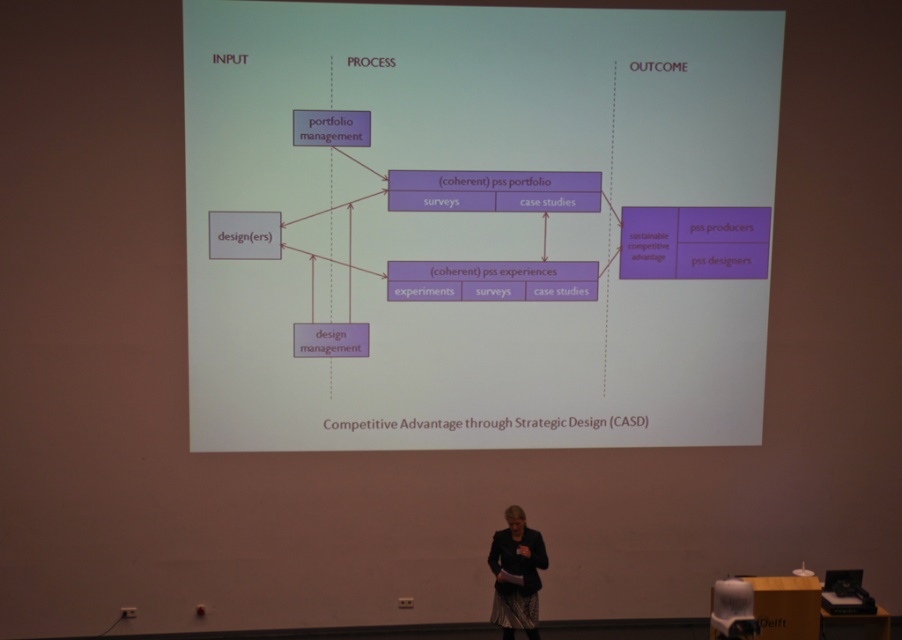
Question: Is purple matte diagram at center wider than dark gray fabric jacket at lower center?

Choices:
 (A) yes
 (B) no

Answer: (A)

Question: Can you confirm if purple matte diagram at center is smaller than dark gray fabric jacket at lower center?

Choices:
 (A) no
 (B) yes

Answer: (A)

Question: Does purple matte diagram at center have a larger size compared to dark gray fabric jacket at lower center?

Choices:
 (A) yes
 (B) no

Answer: (A)